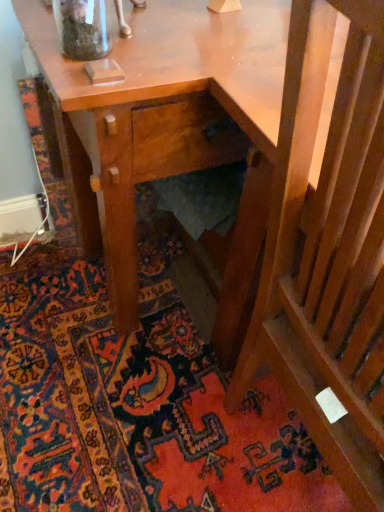
Question: Considering the relative sizes of carpeted stairs at lower right and clear glass jar at upper left in the image provided, is carpeted stairs at lower right taller than clear glass jar at upper left?

Choices:
 (A) yes
 (B) no

Answer: (B)

Question: Is carpeted stairs at lower right facing towards clear glass jar at upper left?

Choices:
 (A) no
 (B) yes

Answer: (A)

Question: Is clear glass jar at upper left located within carpeted stairs at lower right?

Choices:
 (A) yes
 (B) no

Answer: (B)

Question: Considering the relative positions of carpeted stairs at lower right and clear glass jar at upper left in the image provided, is carpeted stairs at lower right to the left of clear glass jar at upper left from the viewer's perspective?

Choices:
 (A) yes
 (B) no

Answer: (A)

Question: From a real-world perspective, is carpeted stairs at lower right positioned under clear glass jar at upper left based on gravity?

Choices:
 (A) yes
 (B) no

Answer: (A)

Question: Is there a large distance between carpeted stairs at lower right and clear glass jar at upper left?

Choices:
 (A) yes
 (B) no

Answer: (B)

Question: From the image's perspective, is wooden slats at lower right located above clear glass jar at upper left?

Choices:
 (A) yes
 (B) no

Answer: (B)

Question: Is wooden slats at lower right taller than clear glass jar at upper left?

Choices:
 (A) no
 (B) yes

Answer: (B)

Question: Does wooden slats at lower right have a lesser height compared to clear glass jar at upper left?

Choices:
 (A) yes
 (B) no

Answer: (B)

Question: From the image's perspective, is wooden slats at lower right beneath clear glass jar at upper left?

Choices:
 (A) yes
 (B) no

Answer: (A)

Question: Does wooden slats at lower right appear on the left side of clear glass jar at upper left?

Choices:
 (A) no
 (B) yes

Answer: (A)

Question: Is wooden slats at lower right not within clear glass jar at upper left?

Choices:
 (A) no
 (B) yes

Answer: (B)

Question: Does carpeted stairs at lower right have a smaller size compared to wooden slats at lower right?

Choices:
 (A) yes
 (B) no

Answer: (A)